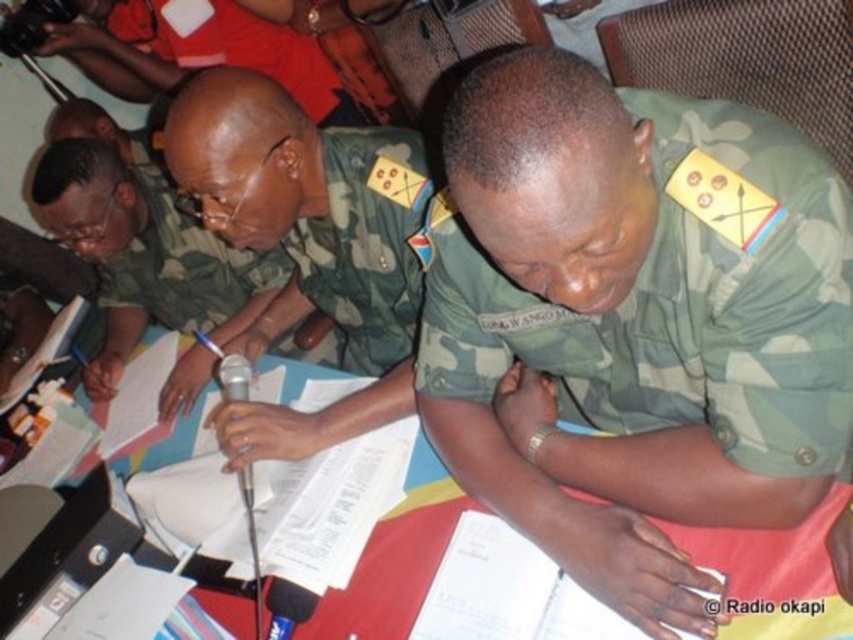
In the scene shown: Which is more to the right, red cotton shirt at upper center or metallic silver microphone at center?

metallic silver microphone at center is more to the right.

Who is taller, red cotton shirt at upper center or metallic silver microphone at center?

Standing taller between the two is red cotton shirt at upper center.

Does point (260, 0) come closer to viewer compared to point (241, 387)?

No.

At what (x,y) coordinates should I click in order to perform the action: click on red cotton shirt at upper center. Please return your answer as a coordinate pair (x, y). This screenshot has height=640, width=853. Looking at the image, I should click on (239, 48).

Which is more to the right, red plastic table at center or red cotton shirt at upper center?

Positioned to the right is red plastic table at center.

The height and width of the screenshot is (640, 853). Describe the element at coordinates (22, 516) in the screenshot. I see `red plastic table at center` at that location.

At what (x,y) coordinates should I click in order to perform the action: click on red plastic table at center. Please return your answer as a coordinate pair (x, y). Looking at the image, I should click on (22, 516).

Who is lower down, camouflage fabric uniform at center or red plastic table at center?

red plastic table at center is below.

Who is positioned more to the left, camouflage fabric uniform at center or red plastic table at center?

Positioned to the left is red plastic table at center.

Between point (341, 131) and point (268, 381), which one is positioned in front?

Point (341, 131)

Where is `camouflage fabric uniform at center`? camouflage fabric uniform at center is located at coordinates (363, 248).